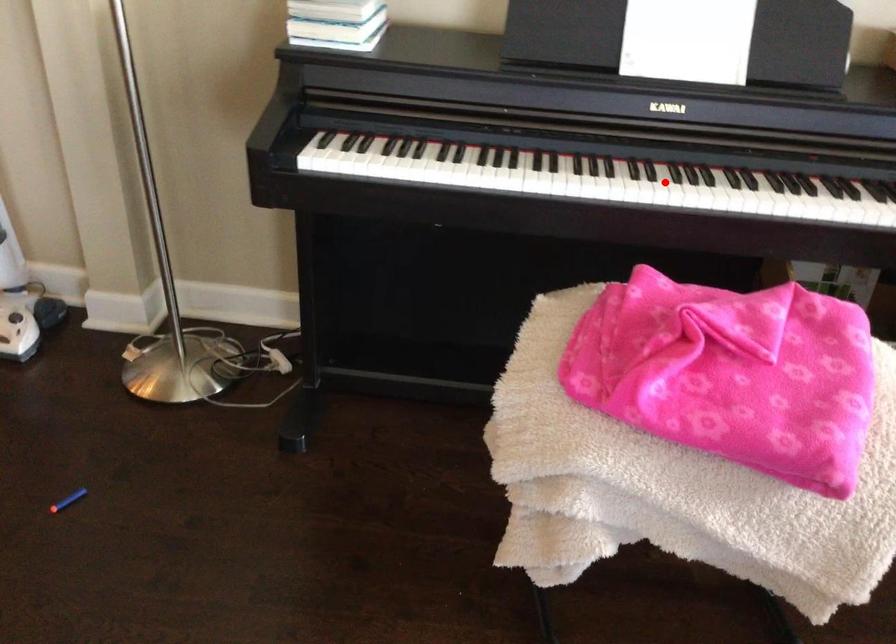
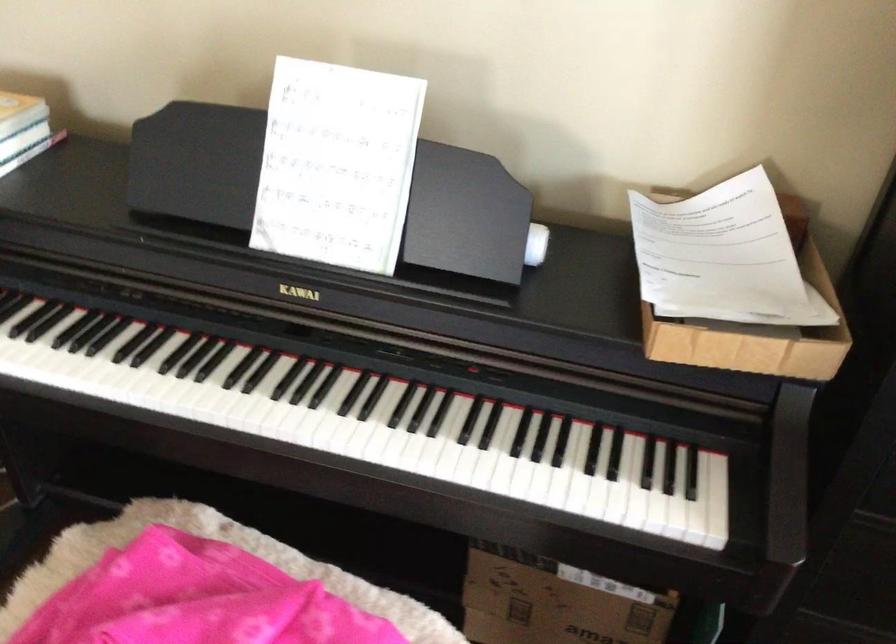
In the second image, find the point that corresponds to the highlighted location in the first image.

(245, 412)